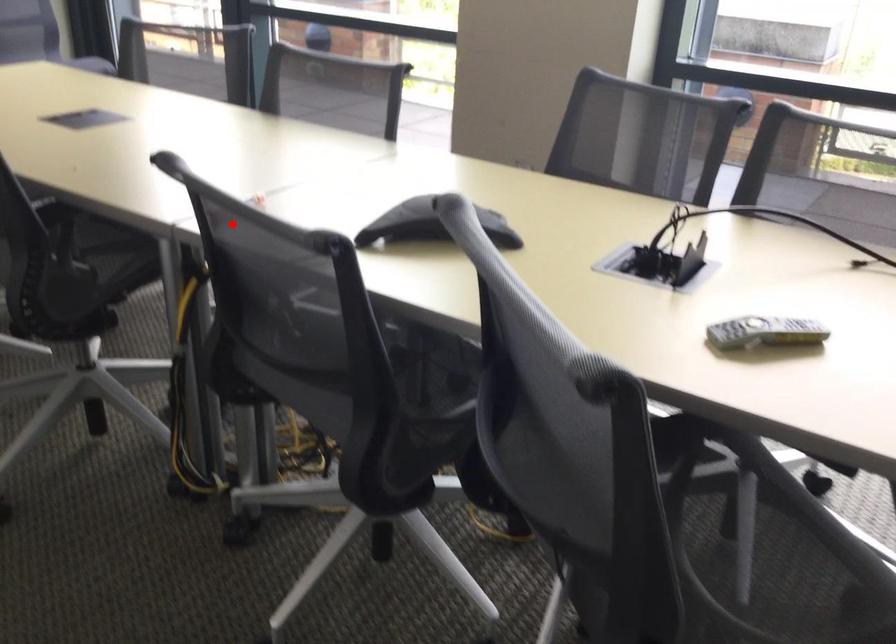
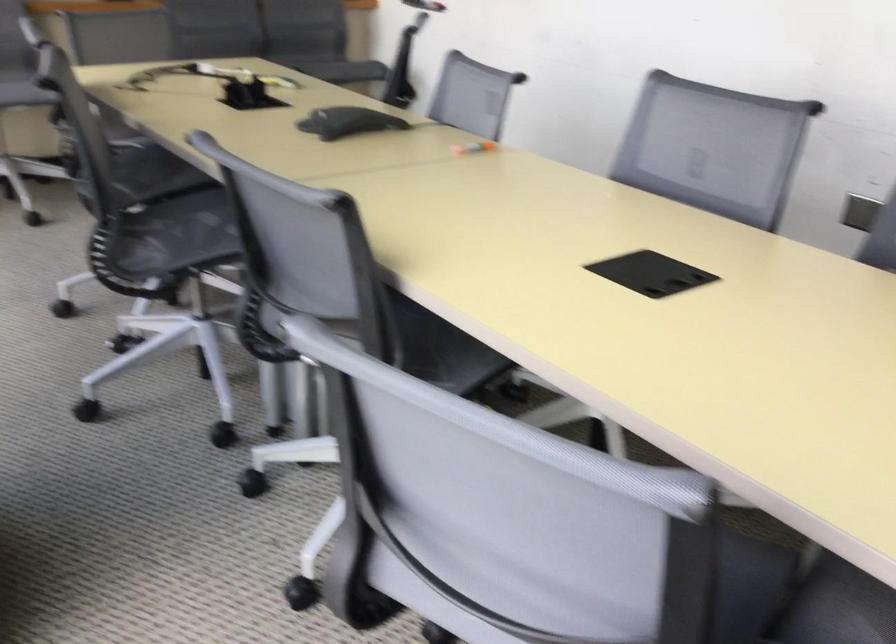
Question: I am providing you with two images of the same scene from different viewpoints. A red point is shown in image1. For the corresponding object point in image2, is it positioned nearer or farther from the camera?

Choices:
 (A) Nearer
 (B) Farther

Answer: (B)